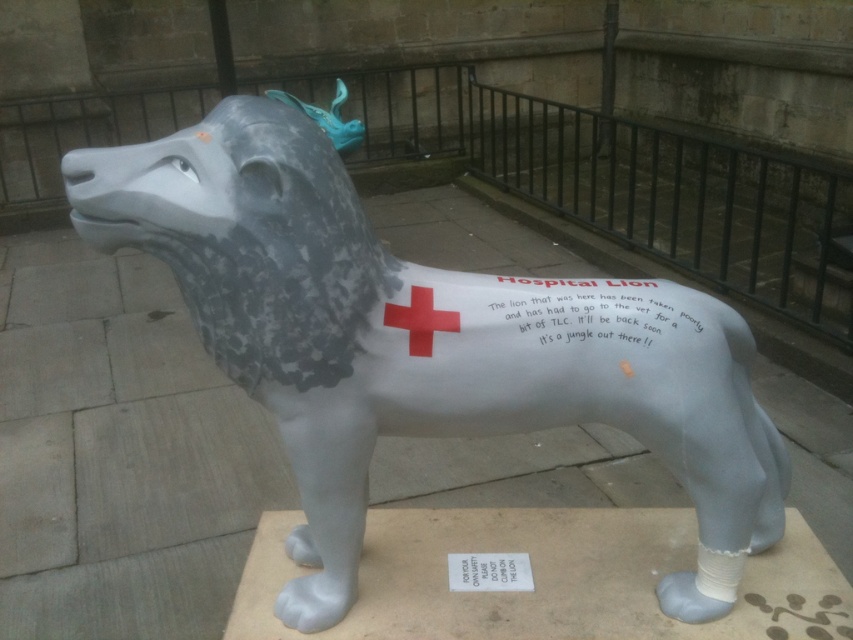
Question: From the image, what is the correct spatial relationship of matte gray lion at center in relation to white paper at center?

Choices:
 (A) left
 (B) right

Answer: (A)

Question: Considering the relative positions of matte gray lion at center and white paper at center in the image provided, where is matte gray lion at center located with respect to white paper at center?

Choices:
 (A) right
 (B) left

Answer: (B)

Question: Which point is farther from the camera taking this photo?

Choices:
 (A) pyautogui.click(x=599, y=323)
 (B) pyautogui.click(x=491, y=560)
 (C) pyautogui.click(x=125, y=163)

Answer: (B)

Question: Among these objects, which one is nearest to the camera?

Choices:
 (A) white paper at lower center
 (B) matte gray lion at center

Answer: (B)

Question: Is matte gray lion at center positioned before white paper at lower center?

Choices:
 (A) no
 (B) yes

Answer: (B)

Question: Which point is farther to the camera?

Choices:
 (A) white paper at center
 (B) white paper at lower center
 (C) matte gray lion at center

Answer: (B)